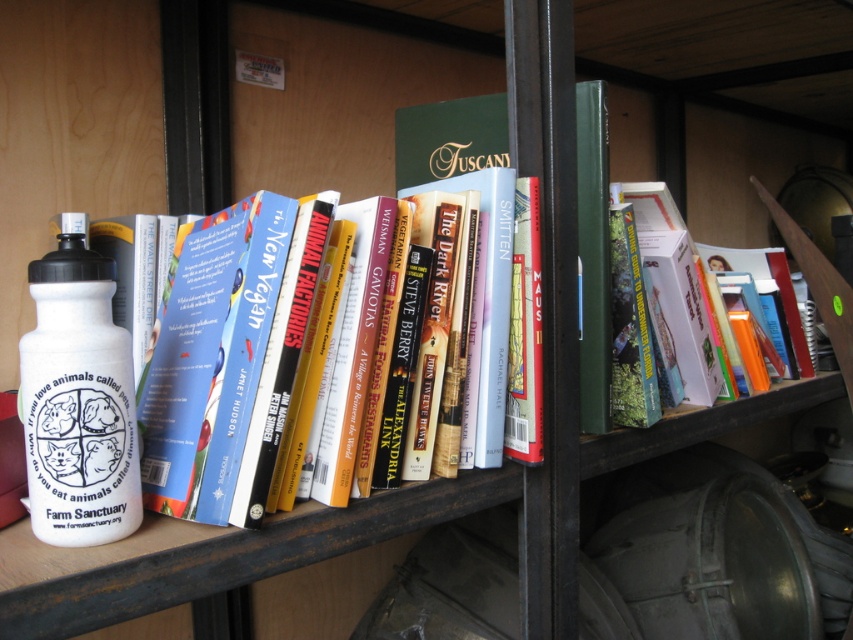
Looking at this image, you are organizing items on a metal shelf and need to place a new item between the white matte water bottle at left and the hardcover book at center. The new item is 10 inches long. Can it fit in the space between them?

The distance between the white matte water bottle at left and the hardcover book at center is 12.30 inches, so a 10 inches item can fit in the space between them.

You have a small box that is 10 cm wide. You want to place either the white matte water bottle at left or the hardcover book at center into the box. Which item can fit inside the box based on their widths?

The hardcover book at center can fit inside the box since the white matte water bottle at left might be wider than the hardcover book at center, and the box is only 10 cm wide.

You are organizing a shelf and need to place a new book. The new book is taller than the white matte water bottle at left but shorter than the hardcover book at center. Where should you place it?

Since the white matte water bottle at left is below the hardcover book at center, you should place the new book between them. It is taller than the water bottle but shorter than the hardcover book, so positioning it in between maintains the size order.